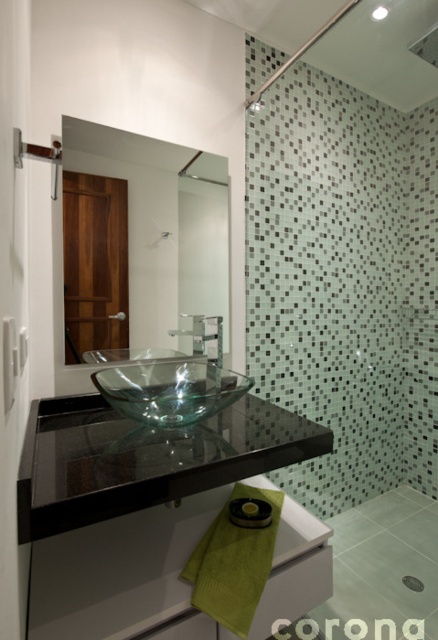
Question: Does satin nickel faucet at upper center have a larger size compared to black rubber towel bar at lower center?

Choices:
 (A) no
 (B) yes

Answer: (B)

Question: Which point is farther to the camera?

Choices:
 (A) (243, 500)
 (B) (230, 381)
 (C) (148, 256)
 (D) (204, 332)

Answer: (D)

Question: Is transparent glass bowl at center further to camera compared to satin nickel faucet at upper center?

Choices:
 (A) no
 (B) yes

Answer: (A)

Question: Is clear glass mirror at upper center positioned at the back of black rubber towel bar at lower center?

Choices:
 (A) no
 (B) yes

Answer: (B)

Question: Which point is farther to the camera?

Choices:
 (A) clear glass mirror at upper center
 (B) transparent glass bowl at center

Answer: (A)

Question: Which point appears closest to the camera in this image?

Choices:
 (A) (236, 512)
 (B) (105, 147)
 (C) (190, 403)

Answer: (C)